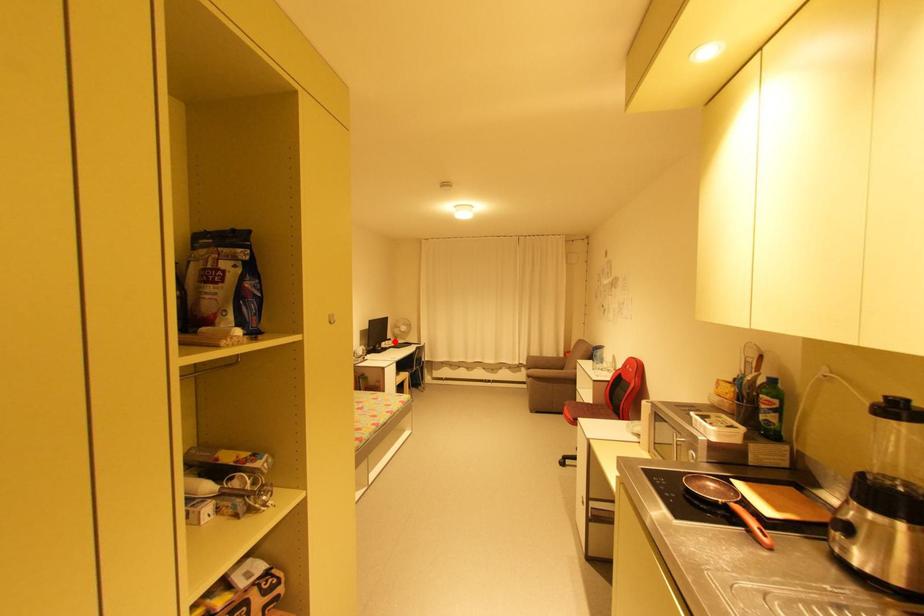
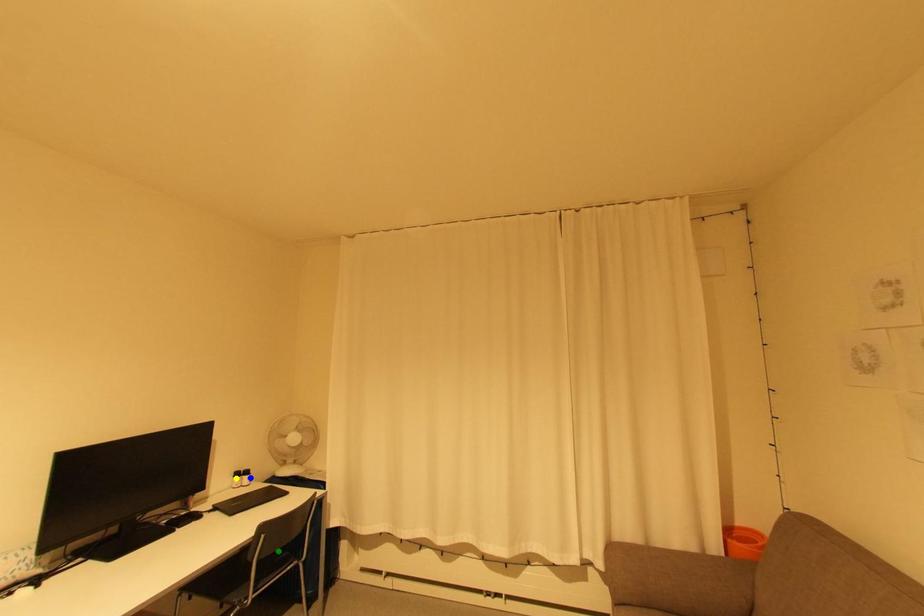
Question: I am providing you with two images of the same scene from different viewpoints. A red point is marked on the first image. You are given multiple points on the second image. Which point in image 2 is actually the same real-world point as the red point in image 1?

Choices:
 (A) green point
 (B) yellow point
 (C) blue point

Answer: (C)